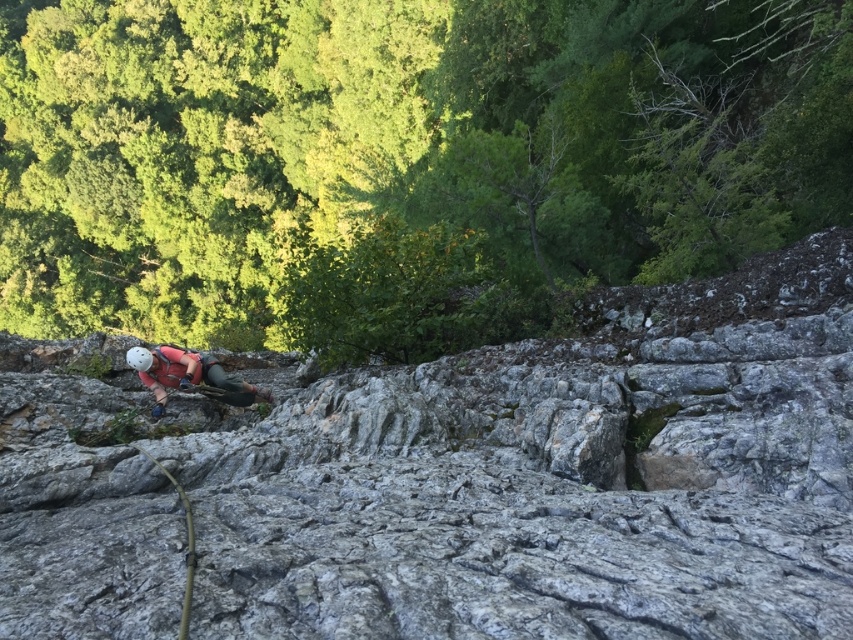
You are a rock climber preparing to attach your gear to the rock. You have the gray rough rock at center and the matte pink climbing harness at center in your view. Which object should you choose to secure your equipment if you need a larger surface area for stability?

You should secure your equipment to the matte pink climbing harness at center because it has a larger size compared to the gray rough rock at center, providing more surface area for stability.